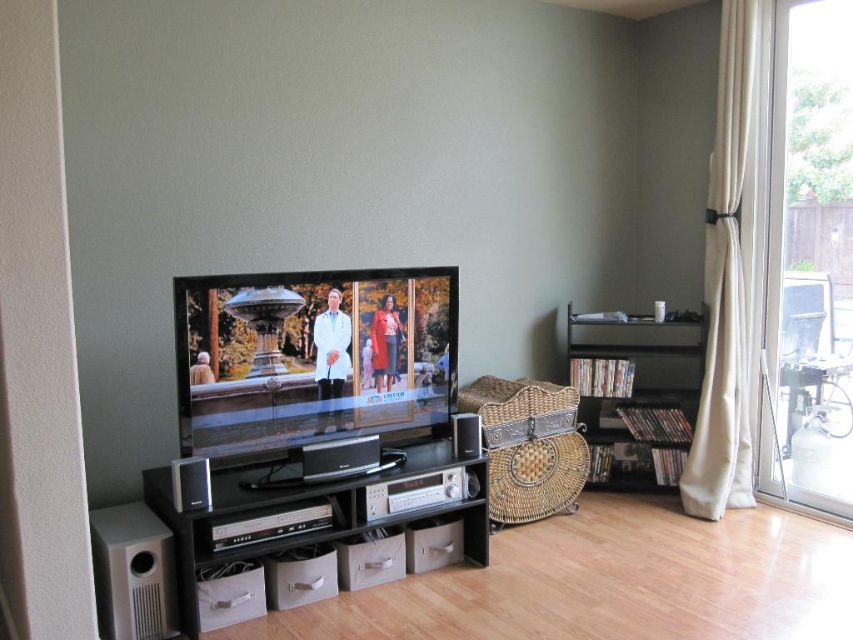
Question: Is flat screen tv at center to the right of black matte bookshelf at right from the viewer's perspective?

Choices:
 (A) yes
 (B) no

Answer: (B)

Question: Does flat screen tv at center have a larger size compared to black matte entertainment center at lower center?

Choices:
 (A) yes
 (B) no

Answer: (B)

Question: Which point is farther from the camera taking this photo?

Choices:
 (A) (705, 449)
 (B) (250, 330)
 (C) (572, 342)

Answer: (C)

Question: Which point appears closest to the camera in this image?

Choices:
 (A) (778, 394)
 (B) (474, 513)
 (C) (653, 355)

Answer: (B)

Question: Which object is farther from the camera taking this photo?

Choices:
 (A) black matte entertainment center at lower center
 (B) white fabric curtain at right
 (C) transparent glass door at right

Answer: (B)

Question: Does black matte entertainment center at lower center appear over white fabric curtain at right?

Choices:
 (A) no
 (B) yes

Answer: (A)